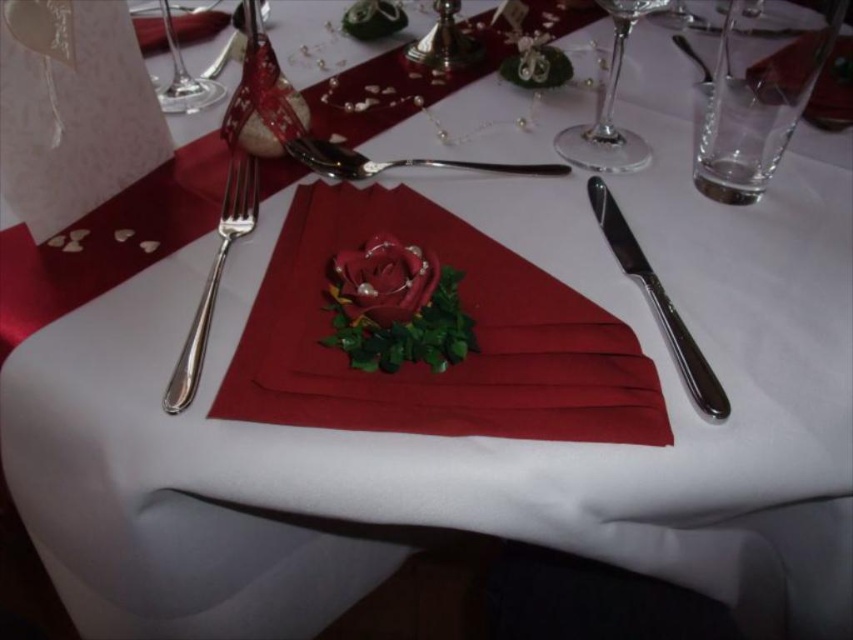
Question: Is burgundy satin napkin at center in front of satin silver fork at left?

Choices:
 (A) yes
 (B) no

Answer: (A)

Question: Estimate the real-world distances between objects in this image. Which object is farther from the burgundy satin napkin at center?

Choices:
 (A) transparent glass wine glass at upper left
 (B) polished metal spoon at center

Answer: (A)

Question: Is satin silver fork at left bigger than polished metal spoon at center?

Choices:
 (A) no
 (B) yes

Answer: (B)

Question: Which of the following is the closest to the observer?

Choices:
 (A) (180, 70)
 (B) (338, 426)
 (C) (664, 321)
 (D) (173, 410)

Answer: (D)

Question: Can you confirm if polished metal spoon at center is positioned below transparent glass wine glass at upper left?

Choices:
 (A) yes
 (B) no

Answer: (A)

Question: Which object is farther from the camera taking this photo?

Choices:
 (A) polished metal spoon at center
 (B) transparent glass wine glass at upper right
 (C) satin silver fork at left
 (D) polished metal knife at right

Answer: (A)